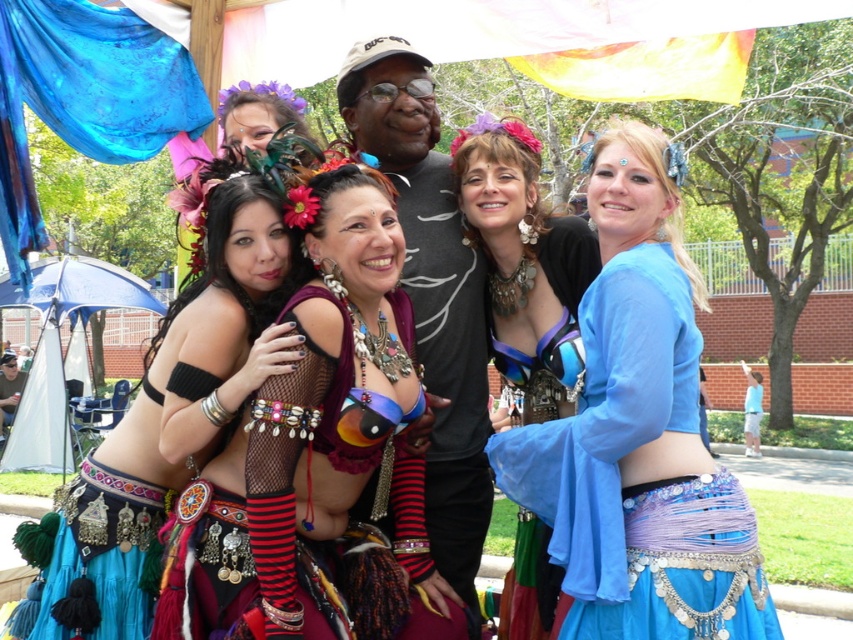
Is shiny metallic belly dancer at center below shiny blue fabric at center?

Yes.

Who is positioned more to the left, shiny metallic belly dancer at center or shiny blue fabric at center?

shiny metallic belly dancer at center

Identify the location of shiny metallic belly dancer at center. The height and width of the screenshot is (640, 853). (323, 448).

Can you confirm if blue fabric belly dancer at right is positioned to the right of shiny blue fabric at center?

Correct, you'll find blue fabric belly dancer at right to the right of shiny blue fabric at center.

Between point (554, 435) and point (519, 292), which one is positioned in front?

Point (554, 435) is more forward.

Who is more distant from viewer, [666,160] or [541,310]?

The point [541,310] is more distant.

The height and width of the screenshot is (640, 853). I want to click on blue fabric belly dancer at right, so [639, 435].

Can you confirm if shiny metallic belly dancer at center is positioned below matte black bikini top at center?

Indeed, shiny metallic belly dancer at center is positioned under matte black bikini top at center.

Is shiny metallic belly dancer at center shorter than matte black bikini top at center?

No, shiny metallic belly dancer at center is not shorter than matte black bikini top at center.

At what (x,y) coordinates should I click in order to perform the action: click on shiny metallic belly dancer at center. Please return your answer as a coordinate pair (x, y). The height and width of the screenshot is (640, 853). Looking at the image, I should click on (323, 448).

At what (x,y) coordinates should I click in order to perform the action: click on shiny metallic belly dancer at center. Please return your answer as a coordinate pair (x, y). Looking at the image, I should click on (323, 448).